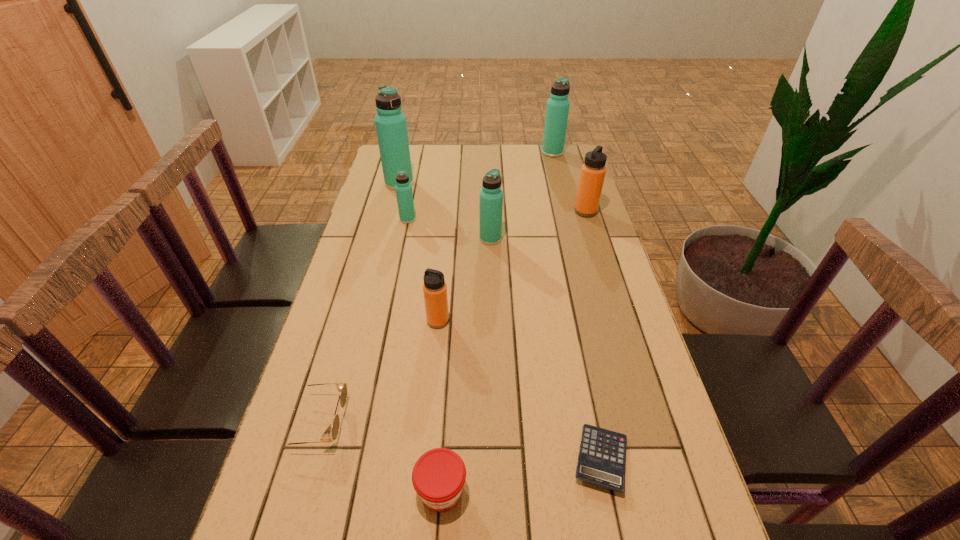
Locate which object is the second closest to the calculator. Please provide its 2D coordinates. Your answer should be formatted as a tuple, i.e. [(x, y)], where the tuple contains the x and y coordinates of a point satisfying the conditions above.

[(434, 288)]

Identify which thermos bottle is the fourth closest to the jam. Please provide its 2D coordinates. Your answer should be formatted as a tuple, i.e. [(x, y)], where the tuple contains the x and y coordinates of a point satisfying the conditions above.

[(593, 170)]

You are a GUI agent. You are given a task and a screenshot of the screen. Output one action in this format:
    pyautogui.click(x=<x>, y=<y>)
    Task: Click on the thermos bottle identified as the fourth closest to the bigger orange thermos bottle
    
    Given the screenshot: What is the action you would take?
    pyautogui.click(x=390, y=122)

At what (x,y) coordinates should I click in order to perform the action: click on aqua thermos bottle that is the closest to the calculator. Please return your answer as a coordinate pair (x, y). The width and height of the screenshot is (960, 540). Looking at the image, I should click on (491, 196).

Select which aqua thermos bottle appears as the third closest to the jam. Please provide its 2D coordinates. Your answer should be formatted as a tuple, i.e. [(x, y)], where the tuple contains the x and y coordinates of a point satisfying the conditions above.

[(390, 122)]

This screenshot has height=540, width=960. Find the location of `vacant space that satisfies the following two spatial constraints: 1. on the back side of the third biggest aqua thermos bottle; 2. on the right side of the right orange thermos bottle`. vacant space that satisfies the following two spatial constraints: 1. on the back side of the third biggest aqua thermos bottle; 2. on the right side of the right orange thermos bottle is located at coordinates (490, 212).

Locate an element on the screen. vacant space that satisfies the following two spatial constraints: 1. on the front side of the calculator; 2. on the right side of the third farthest aqua thermos bottle is located at coordinates (359, 459).